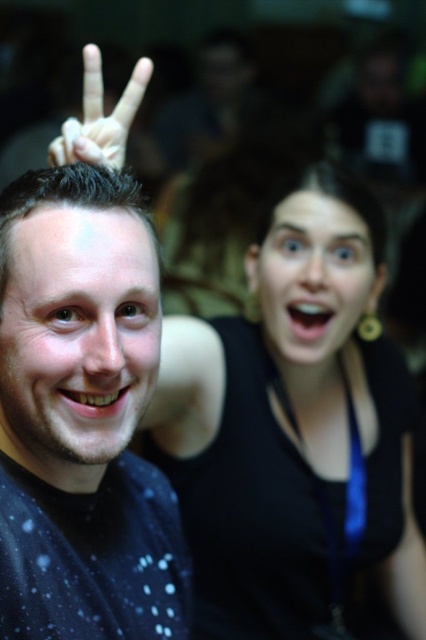
Question: Which point is farther to the camera?

Choices:
 (A) smooth skin face at center
 (B) matte black face at center

Answer: (B)

Question: Among these objects, which one is farthest from the camera?

Choices:
 (A) white matte hand at upper left
 (B) black matte tank top at center
 (C) matte black shirt at center
 (D) matte black face at center

Answer: (D)

Question: Does black matte tank top at center appear on the left side of matte black shirt at center?

Choices:
 (A) yes
 (B) no

Answer: (B)

Question: Is black matte tank top at center above white matte hand at upper left?

Choices:
 (A) yes
 (B) no

Answer: (B)

Question: Among these objects, which one is farthest from the camera?

Choices:
 (A) matte black shirt at center
 (B) black matte tank top at center
 (C) white matte hand at upper left
 (D) smooth skin face at center

Answer: (B)

Question: Does black matte tank top at center appear on the right side of smooth skin face at center?

Choices:
 (A) no
 (B) yes

Answer: (B)